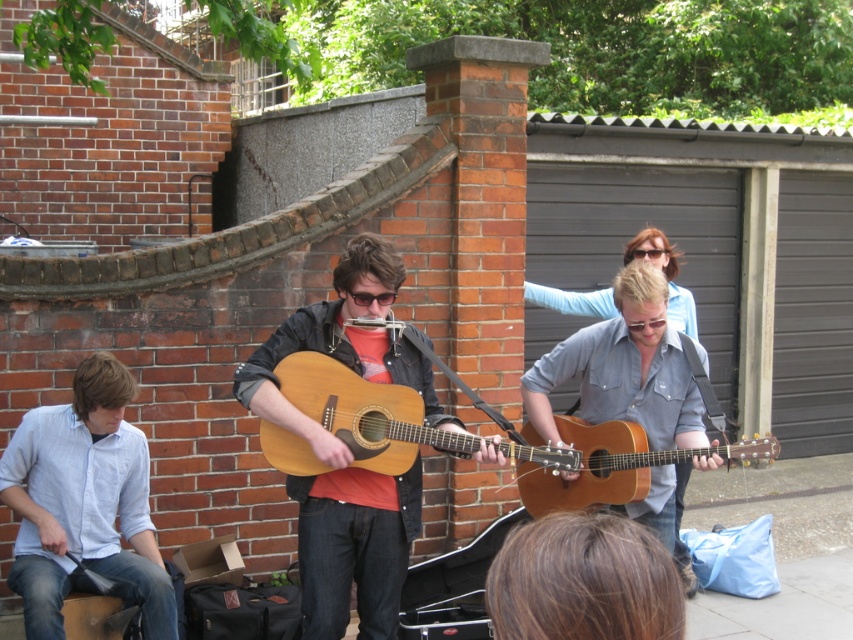
Who is more forward, (509, 532) or (668, 252)?

Positioned in front is point (509, 532).

Find the location of a particular element. The image size is (853, 640). brown hair at lower center is located at coordinates (583, 580).

Between point (418, 394) and point (369, 301), which one is positioned behind?

The point (418, 394) is behind.

Can you confirm if natural wood acoustic guitar at center is positioned above matte black sunglasses at center?

Incorrect, natural wood acoustic guitar at center is not positioned above matte black sunglasses at center.

Is point (402, 449) positioned after point (363, 305)?

Yes, it is behind point (363, 305).

Locate an element on the screen. Image resolution: width=853 pixels, height=640 pixels. natural wood acoustic guitar at center is located at coordinates (364, 412).

Does wooden acoustic guitar at center appear on the left side of brown hair at lower center?

Yes, wooden acoustic guitar at center is to the left of brown hair at lower center.

Is wooden acoustic guitar at center above brown hair at lower center?

Indeed, wooden acoustic guitar at center is positioned over brown hair at lower center.

At what (x,y) coordinates should I click in order to perform the action: click on wooden acoustic guitar at center. Please return your answer as a coordinate pair (x, y). The image size is (853, 640). Looking at the image, I should click on (345, 451).